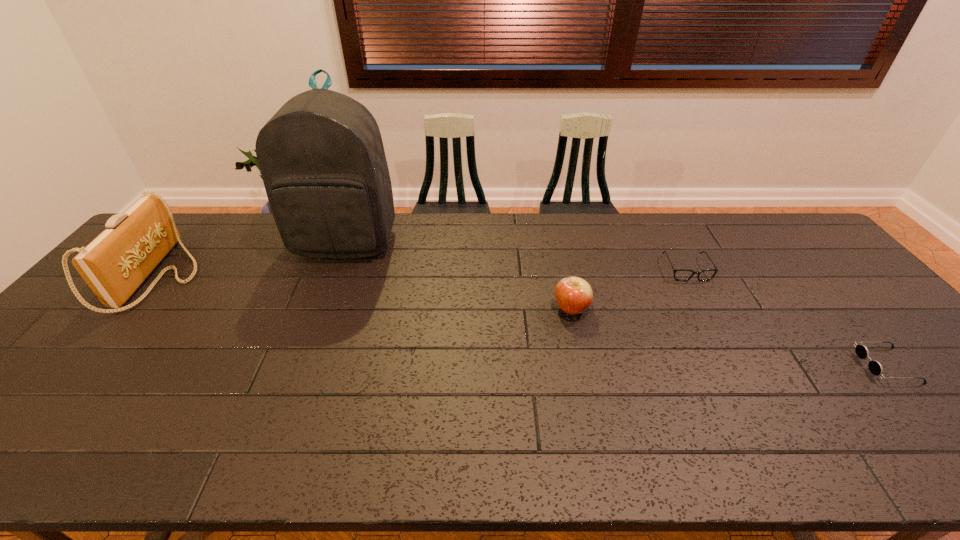
Identify the location of backpack. (321, 156).

Where is `the tallest object`? Image resolution: width=960 pixels, height=540 pixels. the tallest object is located at coordinates (321, 156).

The image size is (960, 540). In order to click on the second tallest object in this screenshot , I will do `click(114, 265)`.

Locate an element on the screen. Image resolution: width=960 pixels, height=540 pixels. the leftmost object is located at coordinates (114, 265).

Where is `apple`? apple is located at coordinates pyautogui.click(x=574, y=295).

Image resolution: width=960 pixels, height=540 pixels. In order to click on the third object from left to right in this screenshot , I will do `click(574, 295)`.

Locate an element on the screen. Image resolution: width=960 pixels, height=540 pixels. the fourth object from left to right is located at coordinates (679, 274).

Where is `the rightmost object`? Image resolution: width=960 pixels, height=540 pixels. the rightmost object is located at coordinates (862, 352).

Find the location of a particular element. The image size is (960, 540). sunglasses is located at coordinates (862, 352).

This screenshot has width=960, height=540. Identify the location of free space located on the front-facing side of the backpack. (327, 292).